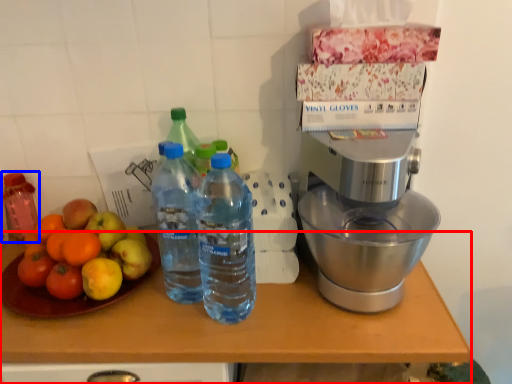
Question: Which point is further to the camera, table (highlighted by a red box) or bottle (highlighted by a blue box)?

Choices:
 (A) table
 (B) bottle

Answer: (B)